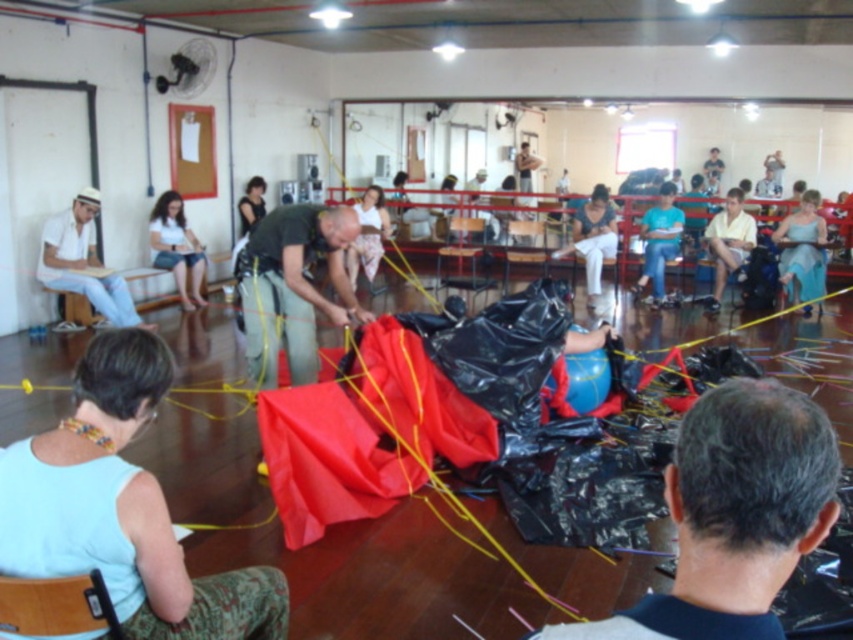
Question: Is green matte tarp at center positioned in front of matte white shirt at left?

Choices:
 (A) yes
 (B) no

Answer: (A)

Question: Considering the relative positions of blue glossy ball at center and blue satin dress at center in the image provided, where is blue glossy ball at center located with respect to blue satin dress at center?

Choices:
 (A) above
 (B) below

Answer: (B)

Question: Is light blue fabric at lower left above white matte shirt at left?

Choices:
 (A) no
 (B) yes

Answer: (A)

Question: Based on their relative distances, which object is nearer to the wooden chair at center?

Choices:
 (A) blue glossy ball at center
 (B) light blue fabric at lower left
 (C) tan fabric belt at lower left
 (D) matte green shirt at center

Answer: (D)

Question: Which of the following is the closest to the observer?

Choices:
 (A) blue denim jeans at center
 (B) tan fabric belt at lower left

Answer: (B)

Question: Which object is closer to the camera taking this photo?

Choices:
 (A) tan fabric belt at lower left
 (B) white matte shirt at left

Answer: (A)